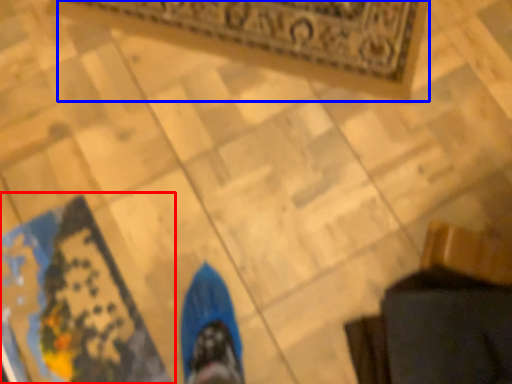
Question: Among these objects, which one is nearest to the camera, mat (highlighted by a red box) or mat (highlighted by a blue box)?

Choices:
 (A) mat
 (B) mat

Answer: (A)